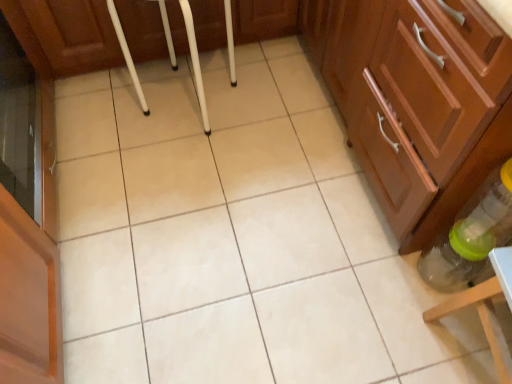
The height and width of the screenshot is (384, 512). I want to click on free space above matte wood cabinet at center-right, the 1th cabinetry positioned from the bottom (from a real-world perspective), so click(x=222, y=196).